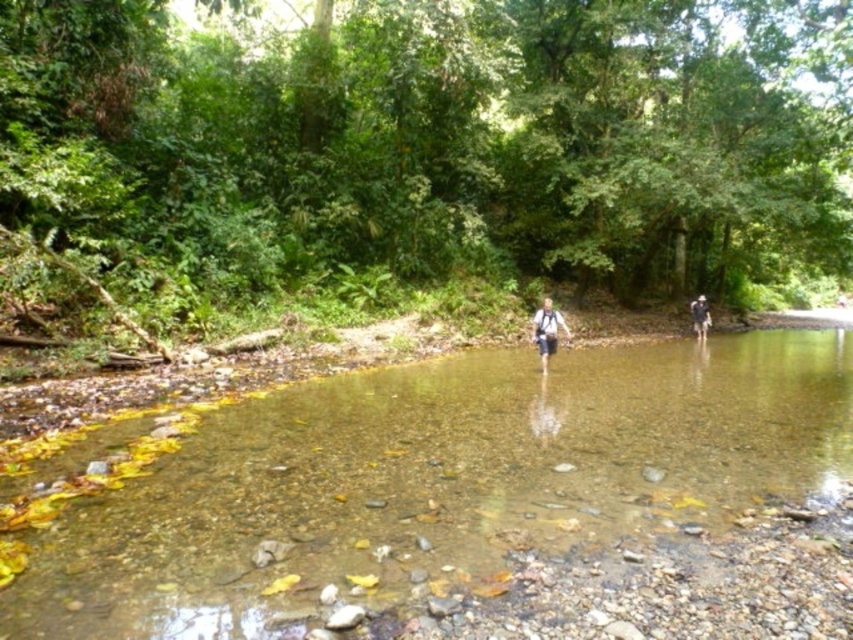
You are planning to set up a small tent in the area shown in the image. Considering the green leafy forest at center and the clear water stream at center, which one is more suitable for setting up the tent? Please explain your choice based on their relative sizes.

The green leafy forest at center is much taller than the clear water stream at center, so the clear water stream at center is shorter. Therefore, the area near the clear water stream at center might be flatter and more suitable for setting up a tent since it is not as elevated or obstructed by the taller forest.

You are a hiker who wants to cross the clear water stream at center. You have a dark blue backpack at right. Which direction should you move your backpack to safely cross the stream?

The clear water stream at center is positioned on the left side of dark blue backpack at right. To safely cross the stream, move the dark blue backpack at right to the right side of the stream.

You are planning to cross the river using the clear water stream at center. However, you notice the white fabric backpack at center is placed nearby. Based on the scene description, is the backpack above or below the stream?

The clear water stream at center is located below the white fabric backpack at center, so the backpack is above the stream.